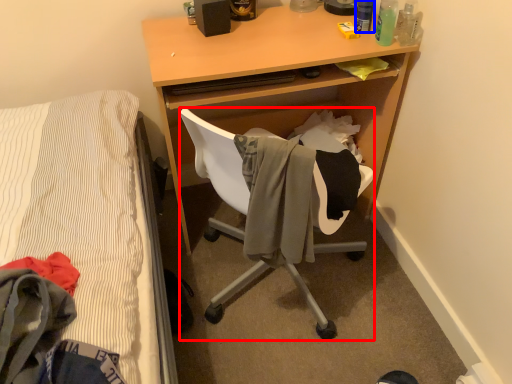
Question: Which of the following is the farthest to the observer, chair (highlighted by a red box) or bottle (highlighted by a blue box)?

Choices:
 (A) chair
 (B) bottle

Answer: (B)